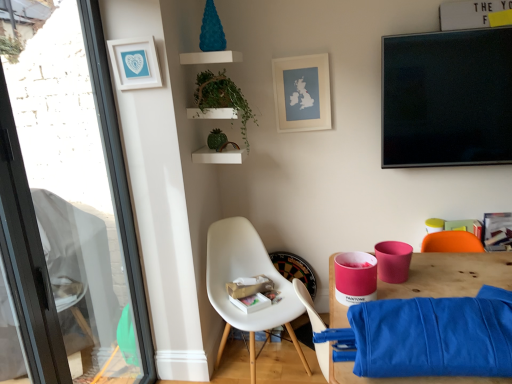
Question: Considering the positions of point (153, 62) and point (215, 274), is point (153, 62) closer or farther from the camera than point (215, 274)?

Choices:
 (A) closer
 (B) farther

Answer: (A)

Question: Considering the positions of white matte picture frame at upper left, the first picture frame viewed from the front, and white plastic chair at lower center in the image, is white matte picture frame at upper left, the first picture frame viewed from the front, wider or thinner than white plastic chair at lower center?

Choices:
 (A) wide
 (B) thin

Answer: (B)

Question: Estimate the real-world distances between objects in this image. Which object is closer to the matte white picture frame at upper center, positioned as the 1th picture frame in back-to-front order?

Choices:
 (A) transparent glass window at left
 (B) green matte plant at upper center
 (C) white plastic chair at lower center
 (D) blue fabric at lower right
 (E) white matte picture frame at upper left, the first picture frame viewed from the front

Answer: (B)

Question: Based on their relative distances, which object is farther from the white matte picture frame at upper left, the first picture frame viewed from the front?

Choices:
 (A) green matte plant at upper center
 (B) matte white picture frame at upper center, arranged as the 1th picture frame when viewed from the right
 (C) transparent glass window at left
 (D) blue fabric at lower right
 (E) white plastic chair at lower center

Answer: (D)